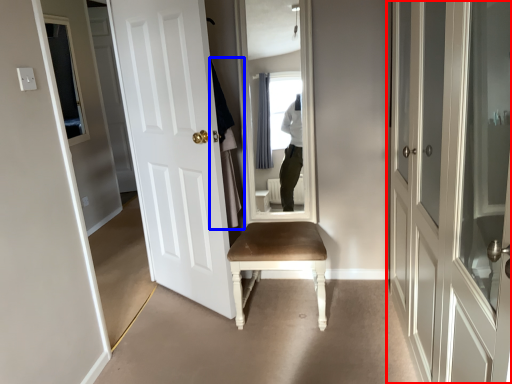
Question: Which point is closer to the camera, door (highlighted by a red box) or robe (highlighted by a blue box)?

Choices:
 (A) door
 (B) robe

Answer: (A)